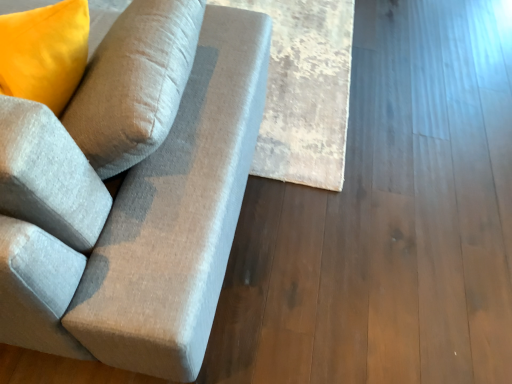
Question: Can you confirm if textured gray fabric couch at left is wider than beige textured rug at center?

Choices:
 (A) no
 (B) yes

Answer: (B)

Question: Would you say textured gray fabric couch at left is outside beige textured rug at center?

Choices:
 (A) no
 (B) yes

Answer: (B)

Question: From the image's perspective, would you say textured gray fabric couch at left is positioned over beige textured rug at center?

Choices:
 (A) no
 (B) yes

Answer: (A)

Question: Does textured gray fabric couch at left have a larger size compared to beige textured rug at center?

Choices:
 (A) no
 (B) yes

Answer: (B)

Question: Does textured gray fabric couch at left touch beige textured rug at center?

Choices:
 (A) yes
 (B) no

Answer: (B)

Question: Considering the relative sizes of textured gray fabric couch at left and beige textured rug at center in the image provided, is textured gray fabric couch at left shorter than beige textured rug at center?

Choices:
 (A) no
 (B) yes

Answer: (A)

Question: From a real-world perspective, is beige textured rug at center on top of textured gray fabric couch at left?

Choices:
 (A) no
 (B) yes

Answer: (A)

Question: Can you confirm if beige textured rug at center is shorter than textured gray fabric couch at left?

Choices:
 (A) yes
 (B) no

Answer: (A)

Question: From the image's perspective, is beige textured rug at center under textured gray fabric couch at left?

Choices:
 (A) yes
 (B) no

Answer: (B)

Question: Is beige textured rug at center wider than textured gray fabric couch at left?

Choices:
 (A) no
 (B) yes

Answer: (A)

Question: Does beige textured rug at center have a smaller size compared to textured gray fabric couch at left?

Choices:
 (A) no
 (B) yes

Answer: (B)

Question: Is beige textured rug at center turned away from textured gray fabric couch at left?

Choices:
 (A) yes
 (B) no

Answer: (B)

Question: Does point (103, 331) appear closer or farther from the camera than point (287, 109)?

Choices:
 (A) farther
 (B) closer

Answer: (B)